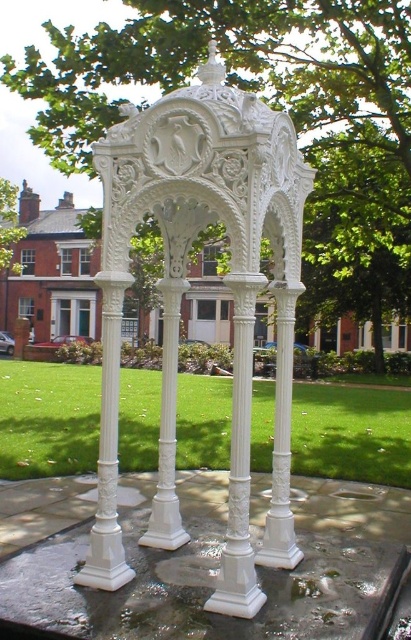
Does point (226, 122) come in front of point (126, 564)?

That is True.

The width and height of the screenshot is (411, 640). In order to click on white carved gazebo at center in this screenshot , I will do `click(180, 298)`.

This screenshot has height=640, width=411. Identify the location of white carved gazebo at center. (180, 298).

Who is more forward, (311,65) or (104,227)?

Point (104,227) is in front.

Who is more forward, (157, 44) or (126, 269)?

Point (126, 269)

Where is `green leafy tree at center`? This screenshot has height=640, width=411. green leafy tree at center is located at coordinates (263, 97).

Does white carved gazebo at center have a larger size compared to green leafy tree at center?

Incorrect, white carved gazebo at center is not larger than green leafy tree at center.

Which is in front, point (156, 100) or point (343, 145)?

Point (343, 145) is in front.

The width and height of the screenshot is (411, 640). I want to click on white carved gazebo at center, so click(x=180, y=298).